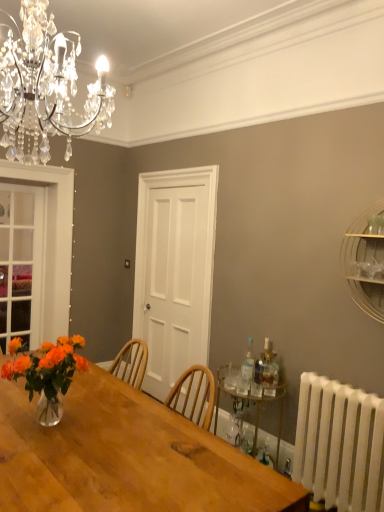
In order to click on translucent glass bottle at right, arranged as the first bottle when viewed from the front in this screenshot , I will do `click(267, 365)`.

What do you see at coordinates (267, 365) in the screenshot? The width and height of the screenshot is (384, 512). I see `translucent glass bottle at right, arranged as the first bottle when viewed from the front` at bounding box center [267, 365].

At what (x,y) coordinates should I click in order to perform the action: click on clear glass door at left. Please return your answer as a coordinate pair (x, y). Looking at the image, I should click on (22, 264).

Image resolution: width=384 pixels, height=512 pixels. I want to click on translucent glass bottle at right, arranged as the second bottle when viewed from the back, so click(x=267, y=365).

From the picture: Is the surface of clear glass bottle at right, the second bottle from the right, in direct contact with clear glass door at left?

No, clear glass bottle at right, the second bottle from the right, is not beside clear glass door at left.

From the image's perspective, between clear glass bottle at right, which is the 2th bottle in front-to-back order, and clear glass door at left, which one is located above?

clear glass door at left, from the image's perspective.

Considering the sizes of objects clear glass bottle at right, the first bottle when ordered from back to front, and clear glass door at left in the image provided, who is wider, clear glass bottle at right, the first bottle when ordered from back to front, or clear glass door at left?

Wider between the two is clear glass bottle at right, the first bottle when ordered from back to front.

Which object is closer to the camera taking this photo, gold metallic bar cart at lower right, which ranks as the first shelf in left-to-right order, or clear glass bottle at right, the second bottle from the right?

gold metallic bar cart at lower right, which ranks as the first shelf in left-to-right order, is in front.

From a real-world perspective, between gold metallic bar cart at lower right, acting as the second shelf starting from the right, and clear glass bottle at right, the second bottle from the right, who is vertically higher?

clear glass bottle at right, the second bottle from the right, is physically above.

Measure the distance from gold metallic bar cart at lower right, the 1th shelf from the back, to clear glass bottle at right, which appears as the 1th bottle when viewed from the left.

gold metallic bar cart at lower right, the 1th shelf from the back, is 11.03 inches away from clear glass bottle at right, which appears as the 1th bottle when viewed from the left.

Is clear glass bottle at right, the second bottle from the right, surrounded by gold metallic bar cart at lower right, marked as the 1th shelf in a bottom-to-top arrangement?

Yes, gold metallic bar cart at lower right, marked as the 1th shelf in a bottom-to-top arrangement, contains clear glass bottle at right, the second bottle from the right.

From the image's perspective, between clear glass door at left and translucent glass bottle at right, marked as the 2th bottle in a left-to-right arrangement, who is located below?

translucent glass bottle at right, marked as the 2th bottle in a left-to-right arrangement, is shown below in the image.

Considering the points (0, 341) and (274, 354), which point is in front, point (0, 341) or point (274, 354)?

The point (274, 354) is closer to the camera.

Is clear glass door at left bigger than translucent glass bottle at right, marked as the 2th bottle in a left-to-right arrangement?

Yes.

Between clear glass door at left and translucent glass bottle at right, arranged as the first bottle when viewed from the front, which one has less height?

translucent glass bottle at right, arranged as the first bottle when viewed from the front, is shorter.

Is gold metallic bar cart at lower right, which ranks as the first shelf in left-to-right order, bigger or smaller than metallic gold shelf at upper right, which is the first shelf in top-to-bottom order?

In the image, gold metallic bar cart at lower right, which ranks as the first shelf in left-to-right order, appears to be larger than metallic gold shelf at upper right, which is the first shelf in top-to-bottom order.

Could you tell me if gold metallic bar cart at lower right, arranged as the second shelf when viewed from the front, is turned towards metallic gold shelf at upper right, which is the first shelf in top-to-bottom order?

No, gold metallic bar cart at lower right, arranged as the second shelf when viewed from the front, does not turn towards metallic gold shelf at upper right, which is the first shelf in top-to-bottom order.

Based on the photo, is gold metallic bar cart at lower right, acting as the second shelf starting from the right, wider or thinner than metallic gold shelf at upper right, marked as the second shelf in a back-to-front arrangement?

In the image, gold metallic bar cart at lower right, acting as the second shelf starting from the right, appears to be wider than metallic gold shelf at upper right, marked as the second shelf in a back-to-front arrangement.

Considering the positions of objects clear glass door at left and clear glass bottle at right, the first bottle when ordered from back to front, in the image provided, who is behind, clear glass door at left or clear glass bottle at right, the first bottle when ordered from back to front,?

clear glass door at left is further from the camera.

From the image's perspective, which object appears higher, clear glass door at left or clear glass bottle at right, the second bottle from the right?

clear glass door at left is shown above in the image.

Can you confirm if clear glass door at left is bigger than clear glass bottle at right, which is the 2th bottle in front-to-back order?

Correct, clear glass door at left is larger in size than clear glass bottle at right, which is the 2th bottle in front-to-back order.

Looking at their sizes, would you say translucent glass vase at table left is wider or thinner than metallic gold shelf at upper right, which is the first shelf in top-to-bottom order?

Clearly, translucent glass vase at table left has more width compared to metallic gold shelf at upper right, which is the first shelf in top-to-bottom order.

From a real-world perspective, is translucent glass vase at table left positioned above or below metallic gold shelf at upper right, which ranks as the 2th shelf in bottom-to-top order?

Clearly, from a real-world perspective, translucent glass vase at table left is below metallic gold shelf at upper right, which ranks as the 2th shelf in bottom-to-top order.

Who is taller, translucent glass vase at table left or metallic gold shelf at upper right, marked as the second shelf in a back-to-front arrangement?

Standing taller between the two is metallic gold shelf at upper right, marked as the second shelf in a back-to-front arrangement.

From the picture: Would you say metallic gold shelf at upper right, marked as the second shelf in a back-to-front arrangement, is part of translucent glass vase at table left's contents?

No.

Which point is more distant from viewer, [148,258] or [250,344]?

The point [148,258] is more distant.

Who is taller, white wooden door at center or clear glass bottle at right, which appears as the 1th bottle when viewed from the left?

Standing taller between the two is white wooden door at center.

From the image's perspective, is white wooden door at center above or below clear glass bottle at right, which appears as the 1th bottle when viewed from the left?

Based on their image positions, white wooden door at center is located above clear glass bottle at right, which appears as the 1th bottle when viewed from the left.

Is white wooden door at center positioned before clear glass bottle at right, which appears as the 1th bottle when viewed from the left?

That is False.

The width and height of the screenshot is (384, 512). I want to click on glass door lying behind the clear glass bottle at right, which appears as the 1th bottle when viewed from the left, so click(22, 264).

In the image, there is a clear glass bottle at right, the second bottle from the right. Identify the location of shelf below it (from a real-world perspective). The width and height of the screenshot is (384, 512). (254, 404).

Looking at this image, which object lies nearer to the anchor point translucent glass vase at table left, white plastic radiator at lower right or translucent glass bottle at right, arranged as the first bottle when viewed from the front?

translucent glass bottle at right, arranged as the first bottle when viewed from the front, lies closer to translucent glass vase at table left than the other object.

Based on the photo, from the image, which object appears to be nearer to translucent glass vase at table left, translucent glass bottle at right, the first bottle in the right-to-left sequence, or metallic gold shelf at upper right, marked as the second shelf in a back-to-front arrangement?

translucent glass bottle at right, the first bottle in the right-to-left sequence.

Considering their positions, is white plastic radiator at lower right positioned further to translucent glass bottle at right, the first bottle in the right-to-left sequence, than white wooden door at center?

Among the two, white wooden door at center is located further to translucent glass bottle at right, the first bottle in the right-to-left sequence.

Considering their positions, is white wooden door at center positioned closer to metallic gold shelf at upper right, which is the first shelf in top-to-bottom order, than translucent glass vase at table left?

translucent glass vase at table left is positioned closer to the anchor metallic gold shelf at upper right, which is the first shelf in top-to-bottom order.

From the picture: Considering their positions, is translucent glass bottle at right, arranged as the second bottle when viewed from the back, positioned closer to metallic gold shelf at upper right, which is the first shelf from front to back, than white wooden door at center?

translucent glass bottle at right, arranged as the second bottle when viewed from the back.

Estimate the real-world distances between objects in this image. Which object is closer to clear glass bottle at right, which appears as the 1th bottle when viewed from the left, translucent glass bottle at right, arranged as the second bottle when viewed from the back, or translucent glass vase at table left?

Among the two, translucent glass bottle at right, arranged as the second bottle when viewed from the back, is located nearer to clear glass bottle at right, which appears as the 1th bottle when viewed from the left.

Looking at the image, which one is located closer to translucent glass bottle at right, the first bottle in the right-to-left sequence, clear glass bottle at right, which appears as the 1th bottle when viewed from the left, or translucent glass vase at table left?

clear glass bottle at right, which appears as the 1th bottle when viewed from the left.

Which object lies further to the anchor point translucent glass bottle at right, the first bottle in the right-to-left sequence, clear glass door at left or gold metallic bar cart at lower right, placed as the 2th shelf when sorted from top to bottom?

Based on the image, clear glass door at left appears to be further to translucent glass bottle at right, the first bottle in the right-to-left sequence.

Locate an element on the screen. Image resolution: width=384 pixels, height=512 pixels. floral arrangement between clear glass door at left and metallic gold shelf at upper right, which ranks as the 2th shelf in bottom-to-top order, in the horizontal direction is located at coordinates click(48, 374).

This screenshot has width=384, height=512. What are the coordinates of `door located between clear glass door at left and clear glass bottle at right, which appears as the 1th bottle when viewed from the left, in the left-right direction` in the screenshot? It's located at (174, 271).

Locate an element on the screen. The width and height of the screenshot is (384, 512). door situated between clear glass door at left and white plastic radiator at lower right from left to right is located at coordinates (174, 271).

I want to click on door between clear glass door at left and translucent glass bottle at right, arranged as the first bottle when viewed from the front, from left to right, so click(x=174, y=271).